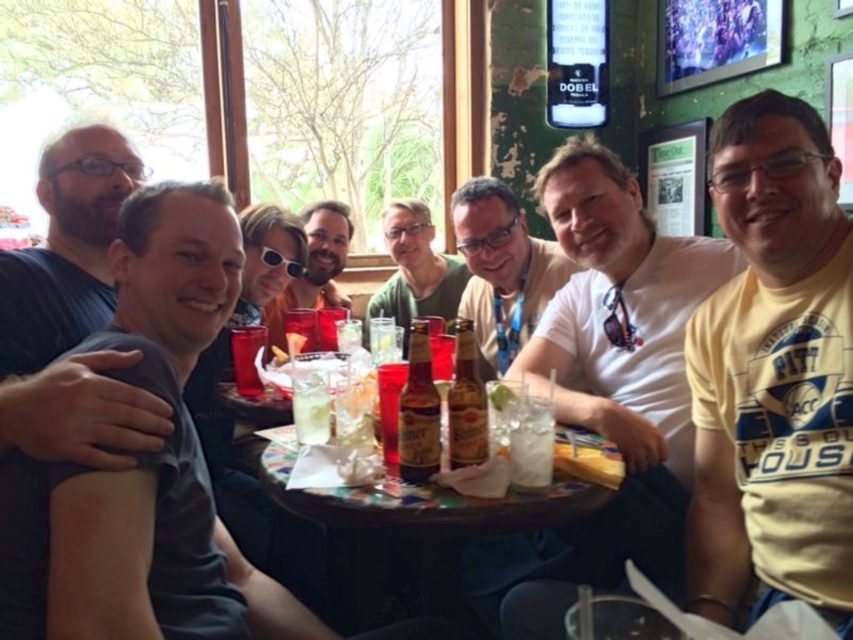
You are a photographer who wants to capture a closeup shot of the matte black sunglasses at center and the brown glass beer bottle at center. Given their sizes, which object should you focus on first to ensure both are in frame without moving the camera?

The matte black sunglasses at center is larger than the brown glass beer bottle at center, so you should focus on positioning the sunglasses first to ensure they fit within the frame, then adjust slightly to include the smaller beer bottle.

You are standing at the point marked as point (308, 300). You need to reach the other side of the room, which is 2.71 meters away. Can you walk straight there without any obstacles?

Yes, you can walk straight to the other side of the room because the distance between you and the other side is 2.71 meters, and there are no obstacles mentioned in the scene description.